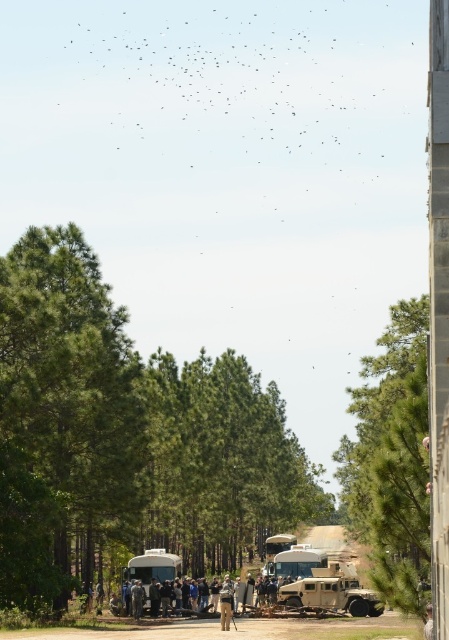
Question: Can you confirm if camouflage fabric military vehicle at center is thinner than camouflage fabric person at center?

Choices:
 (A) yes
 (B) no

Answer: (B)

Question: Does green leafy tree at center have a lesser width compared to green leafy tree at right?

Choices:
 (A) yes
 (B) no

Answer: (B)

Question: Which point is farther to the camera?

Choices:
 (A) camouflage fabric person at center
 (B) green leafy tree at right
 (C) green leafy tree at left

Answer: (A)

Question: Which point is closer to the camera?

Choices:
 (A) camouflage fabric military vehicle at center
 (B) camouflage fabric person at center
 (C) green leafy tree at left
 (D) green leafy tree at center

Answer: (C)

Question: Does green leafy tree at right appear on the right side of camouflage fabric person at center?

Choices:
 (A) yes
 (B) no

Answer: (A)

Question: Which object is closer to the camera taking this photo?

Choices:
 (A) camouflage fabric military vehicle at center
 (B) matte white rv at center

Answer: (A)